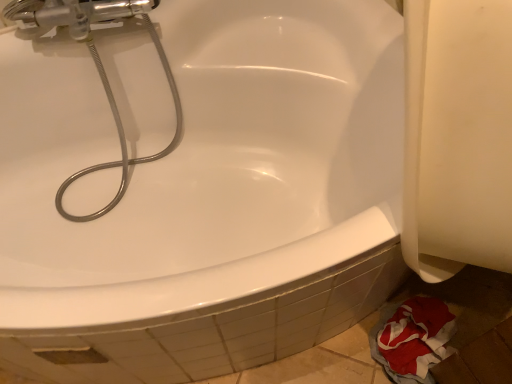
The image size is (512, 384). What do you see at coordinates (123, 132) in the screenshot?
I see `metallic flexible hose at upper left` at bounding box center [123, 132].

Measure the distance between metallic flexible hose at upper left and camera.

metallic flexible hose at upper left is 38.48 inches away from camera.

I want to click on metallic flexible hose at upper left, so click(x=123, y=132).

You are a GUI agent. You are given a task and a screenshot of the screen. Output one action in this format:
    pyautogui.click(x=<x>, y=<y>)
    Task: Click on the metallic flexible hose at upper left
    Image resolution: width=512 pixels, height=384 pixels.
    Given the screenshot: What is the action you would take?
    pyautogui.click(x=123, y=132)